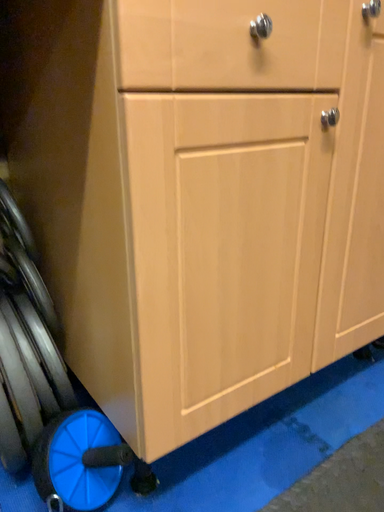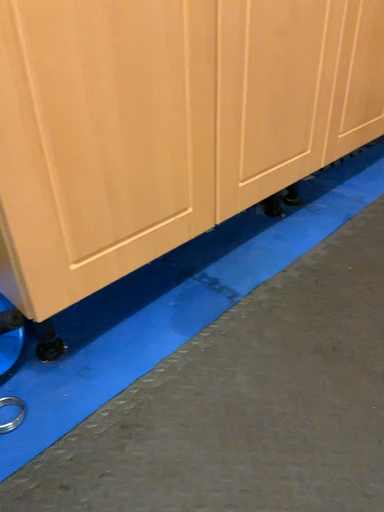
Question: Which way did the camera rotate in the video?

Choices:
 (A) rotated downward
 (B) rotated upward

Answer: (A)